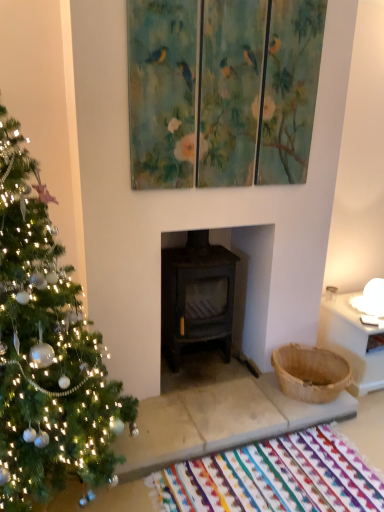
Question: From the image's perspective, is multicolored woven mat at lower center positioned above or below painted wood triptych at upper center?

Choices:
 (A) above
 (B) below

Answer: (B)

Question: Considering the positions of multicolored woven mat at lower center and painted wood triptych at upper center in the image, is multicolored woven mat at lower center taller or shorter than painted wood triptych at upper center?

Choices:
 (A) tall
 (B) short

Answer: (B)

Question: Which object is positioned closest to the multicolored woven mat at lower center?

Choices:
 (A) green matte christmas tree at left
 (B) painted wood triptych at upper center

Answer: (A)

Question: Considering the real-world distances, which object is farthest from the green matte christmas tree at left?

Choices:
 (A) painted wood triptych at upper center
 (B) multicolored woven mat at lower center

Answer: (A)